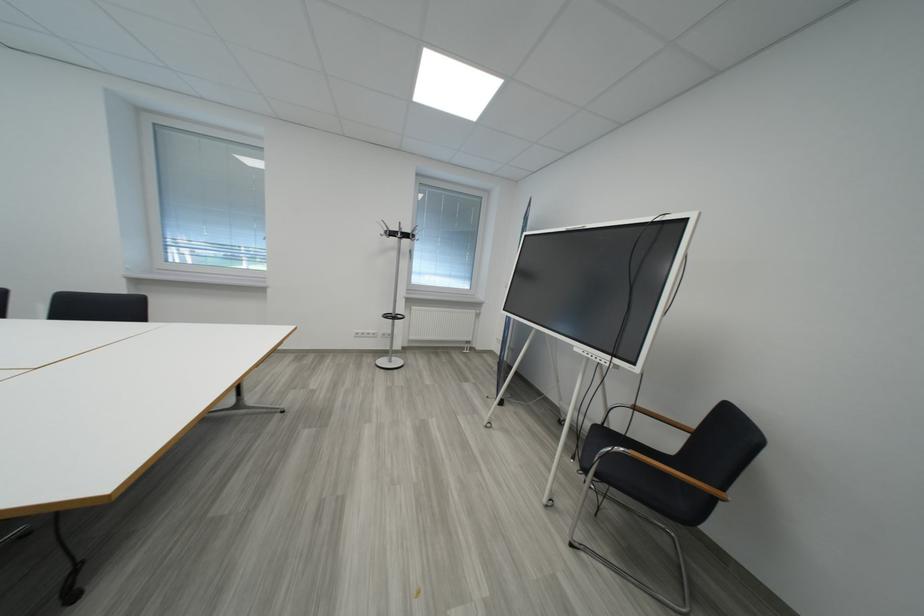
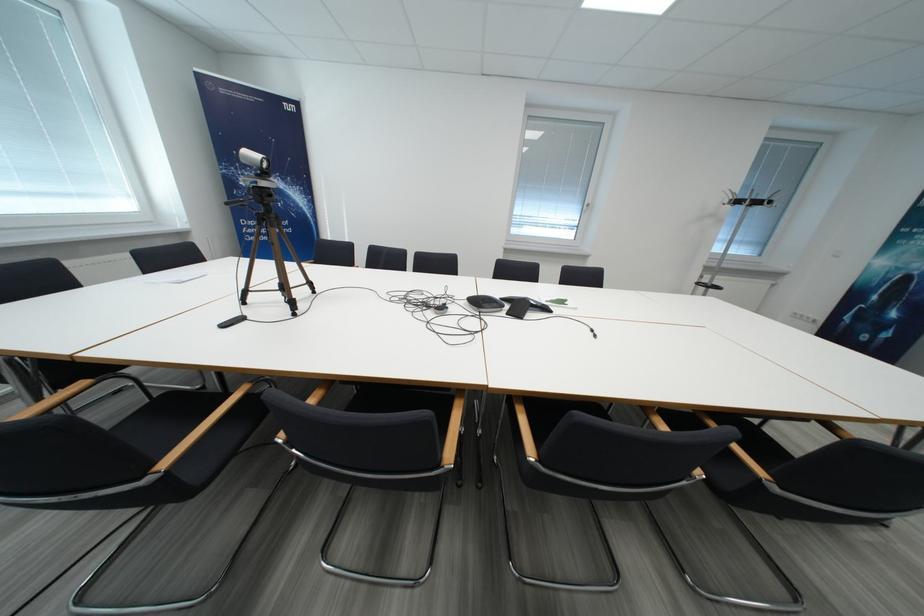
What movement of the cameraman would produce the second image?

The movement direction of the cameraman is left, backward.